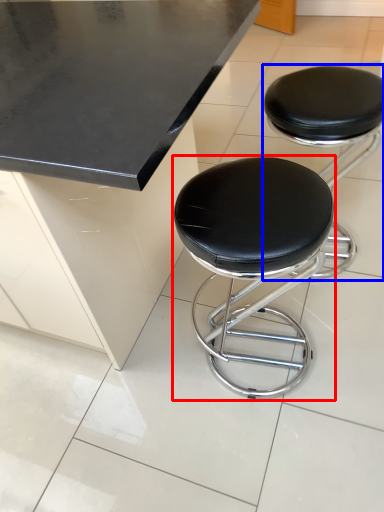
Question: Which of the following is the farthest to the observer, stool (highlighted by a red box) or stool (highlighted by a blue box)?

Choices:
 (A) stool
 (B) stool

Answer: (B)